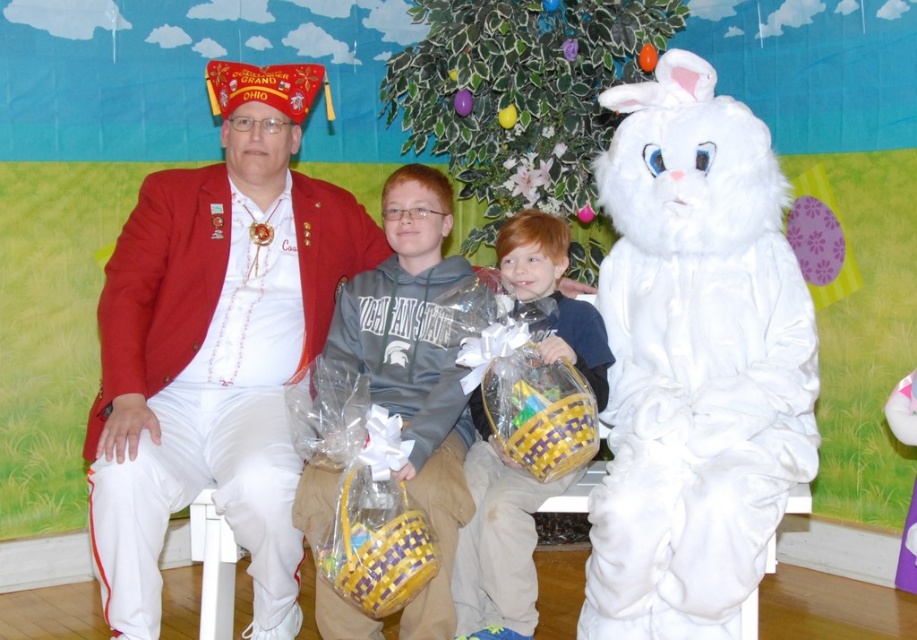
You are organizing a Easter egg hunt and need to place two baskets in the image. The baskets are the matte yellow basket at center and the woven yellow and purple basket at center. The minimum distance required between the baskets for safety is 7 inches. Based on the current placement, can the baskets stay where they are?

The matte yellow basket at center is 6.86 inches away from the woven yellow and purple basket at center. Since the required minimum distance is 7 inches, the baskets are too close and need to be moved further apart to meet safety guidelines.

Based on the scene description, can you determine the spatial relationship between the white fluffy bunny at right and the matte yellow basket at center? Specifically, is the bunny located above or below the basket?

The white fluffy bunny at right is positioned over matte yellow basket at center, meaning it is located above the basket.